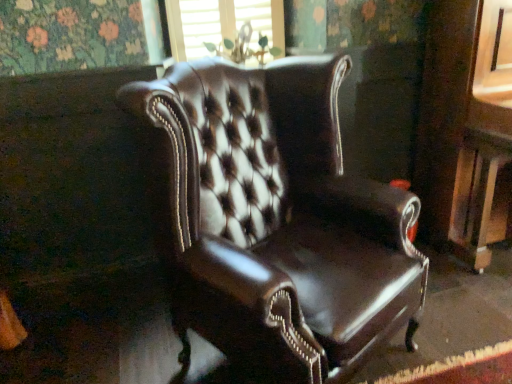
Question: From a real-world perspective, is wooden window frame at upper center physically located above or below shiny brown leather chair at center?

Choices:
 (A) above
 (B) below

Answer: (A)

Question: Considering the positions of point (189, 34) and point (347, 200), is point (189, 34) closer or farther from the camera than point (347, 200)?

Choices:
 (A) closer
 (B) farther

Answer: (B)

Question: Is wooden window frame at upper center in front of or behind shiny brown leather chair at center in the image?

Choices:
 (A) behind
 (B) front

Answer: (A)

Question: Is shiny brown leather chair at center to the left or to the right of wooden window frame at upper center in the image?

Choices:
 (A) left
 (B) right

Answer: (B)

Question: Considering the positions of shiny brown leather chair at center and wooden window frame at upper center in the image, is shiny brown leather chair at center wider or thinner than wooden window frame at upper center?

Choices:
 (A) wide
 (B) thin

Answer: (A)

Question: From the image's perspective, is shiny brown leather chair at center above or below wooden window frame at upper center?

Choices:
 (A) below
 (B) above

Answer: (A)

Question: From a real-world perspective, is shiny brown leather chair at center positioned above or below wooden window frame at upper center?

Choices:
 (A) above
 (B) below

Answer: (B)